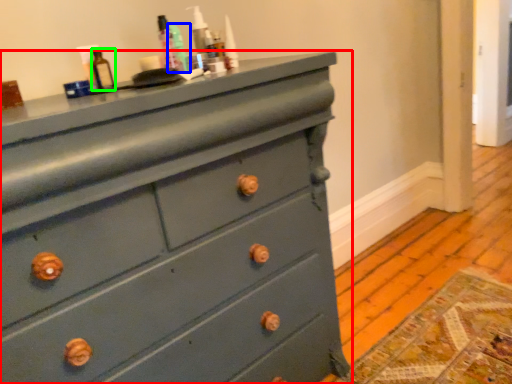
Question: Which object is positioned closest to chest of drawers (highlighted by a red box)? Select from teal (highlighted by a blue box) and bottle (highlighted by a green box).

Choices:
 (A) teal
 (B) bottle

Answer: (A)